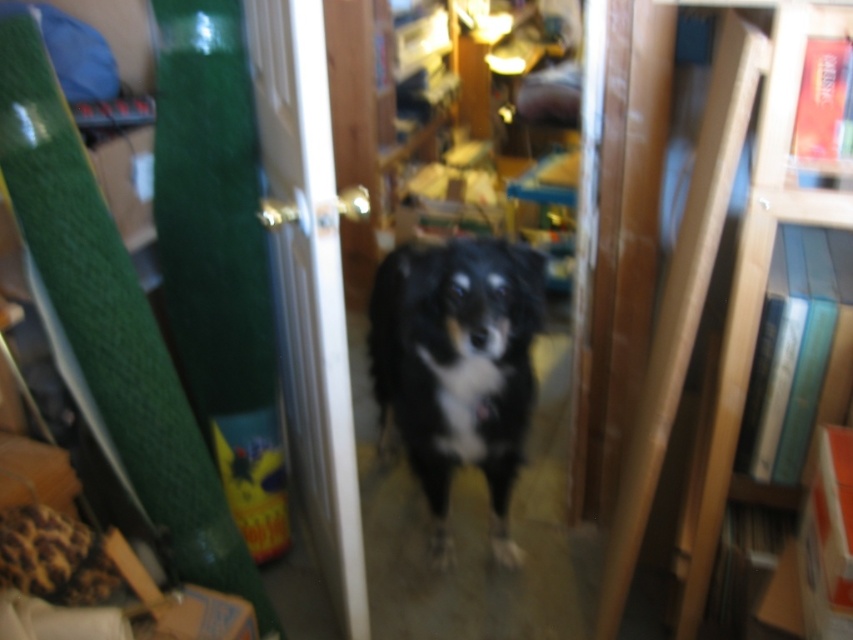
You are trying to decide whether to place a tall potted plant next to the wooden bookcase at right and the black fur dog at center. Based on their heights, which object should the plant be placed next to to ensure it doesn not block the view of the shorter one?

The wooden bookcase at right is taller than the black fur dog at center. Therefore, the tall potted plant should be placed next to the black fur dog at center to avoid blocking the view of the shorter object.

You are trying to move a large painting that is 1.5 meters wide into the room where the wooden bookcase at right and the black fur dog at center are located. Based on their sizes, can the painting fit through the doorway without needing to be tilted?

The wooden bookcase at right occupies less space than the black fur dog at center. However, the description does not provide specific measurements for either object or the doorway. Therefore, it is impossible to determine if the painting can fit through the doorway without additional information about the doorway dimensions or the exact sizes of the objects.

Looking at this image, you are a delivery person holding a large package that is 18 inches wide. You need to pass through the space between the wooden bookcase at right and the black fur dog at center to reach the hallway. Can you fit through the space?

The wooden bookcase at right is 17.75 inches from the black fur dog at center, so the space is narrower than the 18 inch wide package. The package cannot fit through the space.